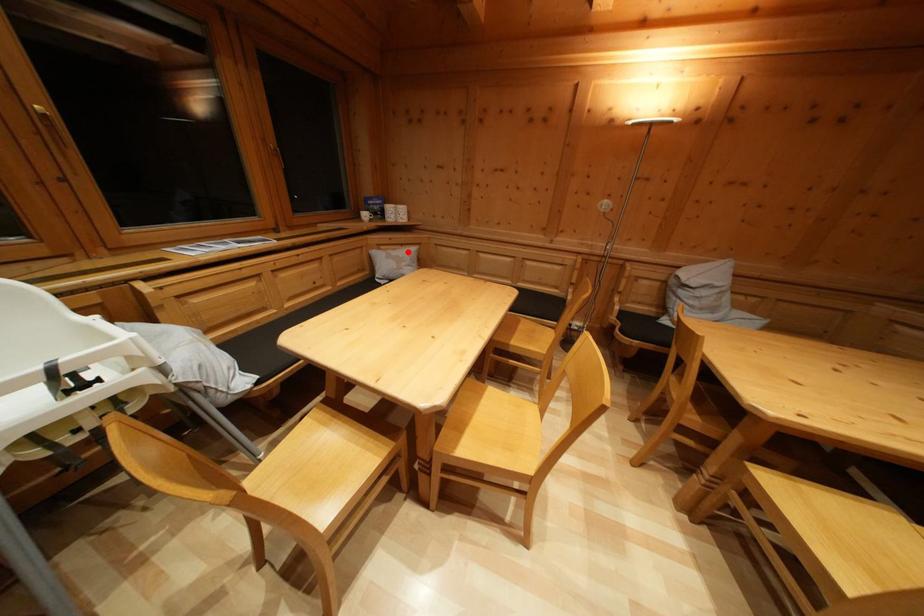
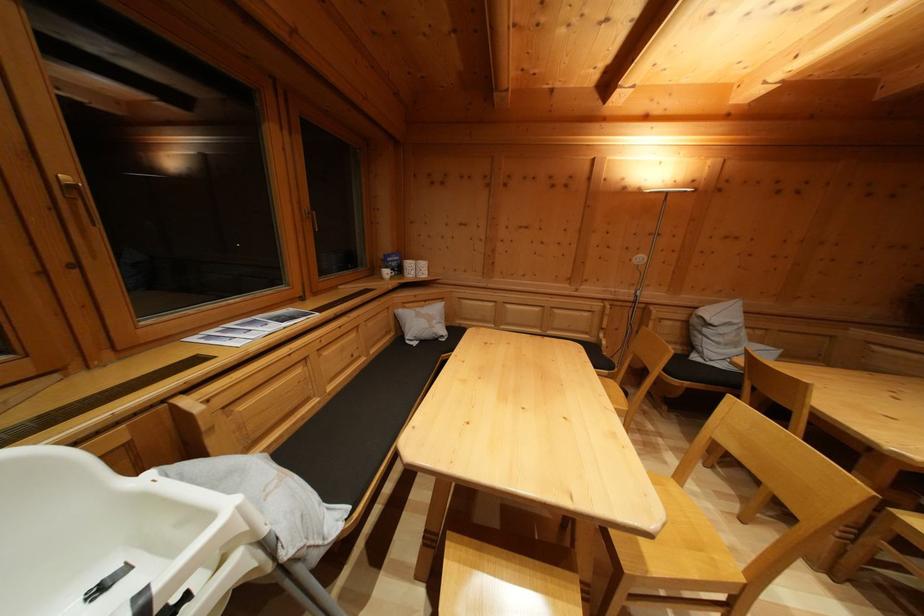
Find the pixel in the second image that matches the highlighted location in the first image.

(431, 308)